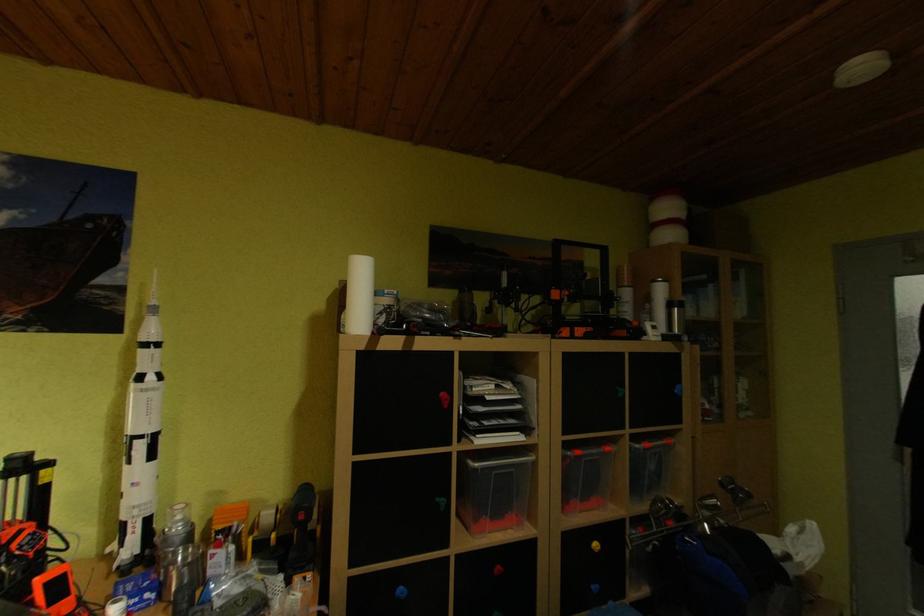
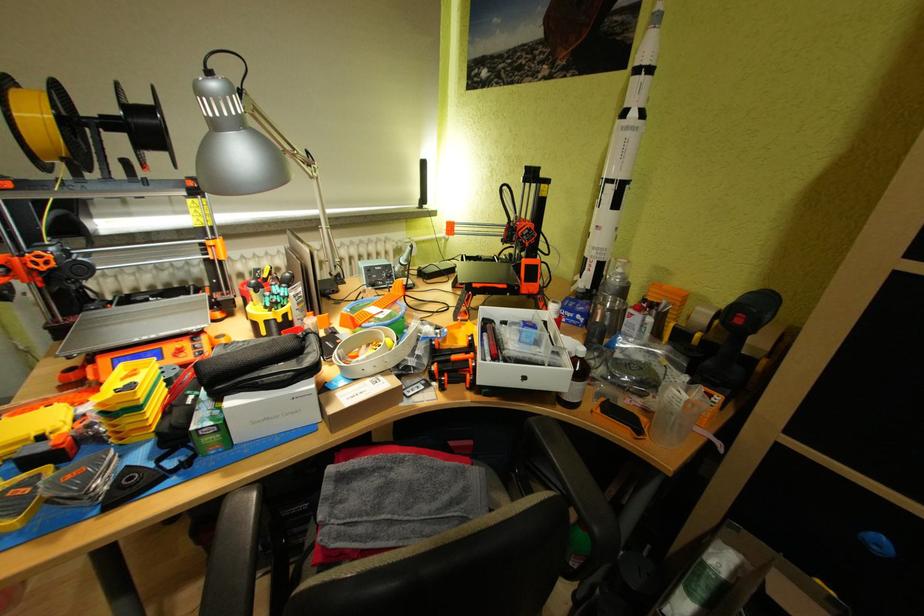
How did the camera likely rotate?

The camera's rotation is toward left-down.